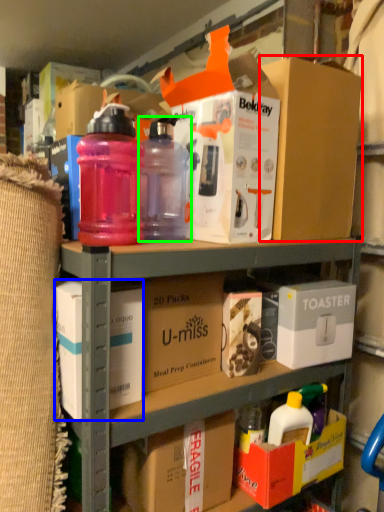
Question: Which object is the farthest from box (highlighted by a red box)? Choose among these: box (highlighted by a blue box) or bottle (highlighted by a green box).

Choices:
 (A) box
 (B) bottle

Answer: (A)